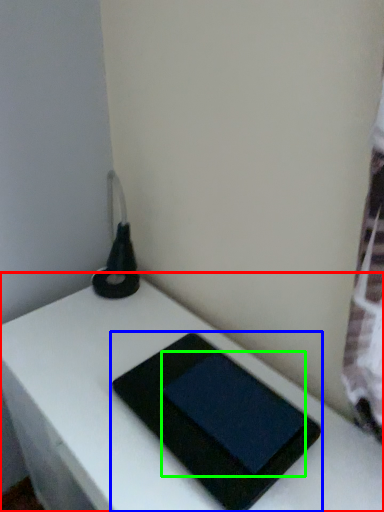
Question: Based on their relative distances, which object is farther from table (highlighted by a red box)? Choose from tablet computer (highlighted by a blue box) and tablet computer (highlighted by a green box).

Choices:
 (A) tablet computer
 (B) tablet computer

Answer: (B)